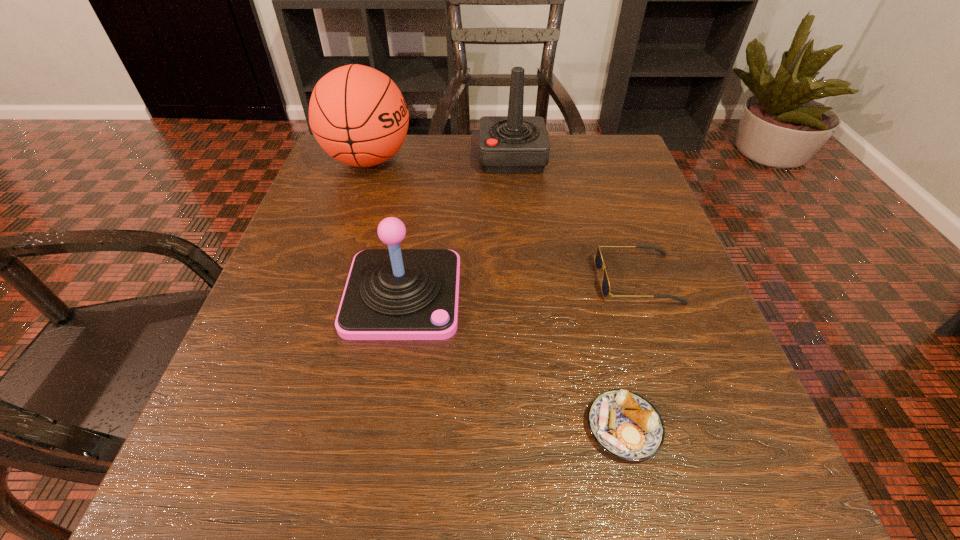
Locate an element on the screen. The width and height of the screenshot is (960, 540). basketball is located at coordinates (358, 115).

Identify the location of the taller joystick. (515, 143).

I want to click on the farther joystick, so click(x=515, y=143).

This screenshot has width=960, height=540. I want to click on the nearer joystick, so pos(391,294).

At what (x,y) coordinates should I click in order to perform the action: click on the third shortest object. Please return your answer as a coordinate pair (x, y). The width and height of the screenshot is (960, 540). Looking at the image, I should click on (391, 294).

Where is `sunglasses`? The image size is (960, 540). sunglasses is located at coordinates (598, 261).

Where is `the nearest object`? The height and width of the screenshot is (540, 960). the nearest object is located at coordinates tap(624, 424).

Where is `the shortest object`? Image resolution: width=960 pixels, height=540 pixels. the shortest object is located at coordinates click(624, 424).

Where is `free point located on the side with logo of the basketball`? The image size is (960, 540). free point located on the side with logo of the basketball is located at coordinates (436, 160).

Locate an element on the screen. This screenshot has width=960, height=540. vacant space located on the front-facing side of the right joystick is located at coordinates (376, 158).